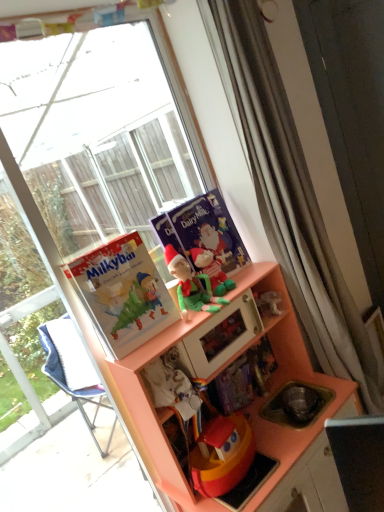
Where is `free space in front of matte paper comic book at left, the 1th comic book when ordered from front to back`? The width and height of the screenshot is (384, 512). free space in front of matte paper comic book at left, the 1th comic book when ordered from front to back is located at coordinates (143, 347).